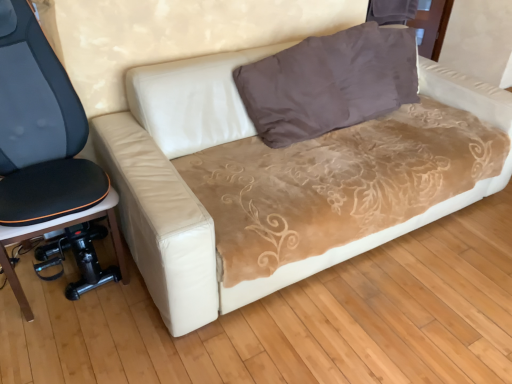
Question: In terms of height, does beige suede couch at center look taller or shorter compared to brown velvety pillow at upper center?

Choices:
 (A) short
 (B) tall

Answer: (B)

Question: From a real-world perspective, is beige suede couch at center positioned above or below brown velvety pillow at upper center?

Choices:
 (A) below
 (B) above

Answer: (A)

Question: Estimate the real-world distances between objects in this image. Which object is closer to the brown velvety pillow at upper center?

Choices:
 (A) black fabric office chair at left
 (B) beige suede couch at center

Answer: (B)

Question: Considering the real-world distances, which object is farthest from the beige suede couch at center?

Choices:
 (A) brown velvety pillow at upper center
 (B) black fabric office chair at left

Answer: (B)